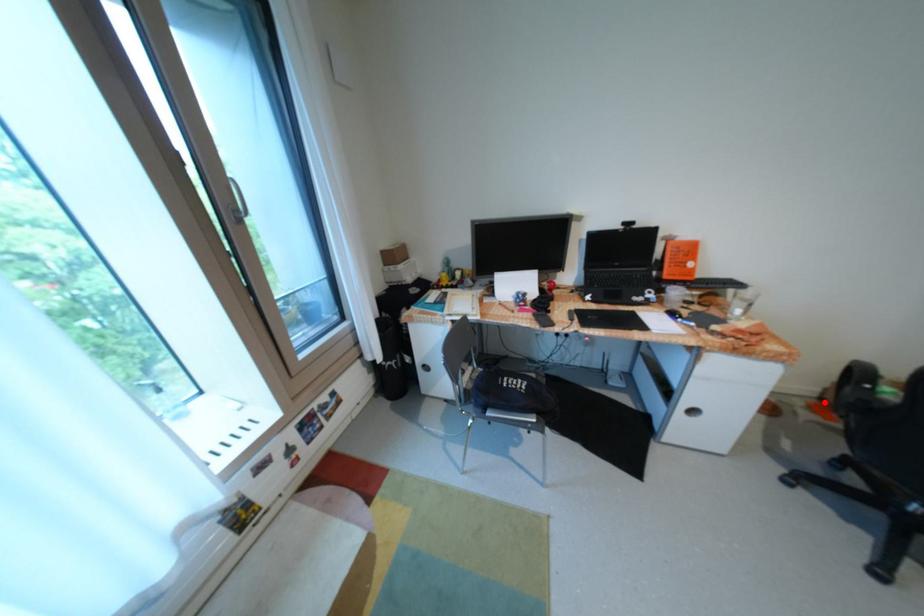
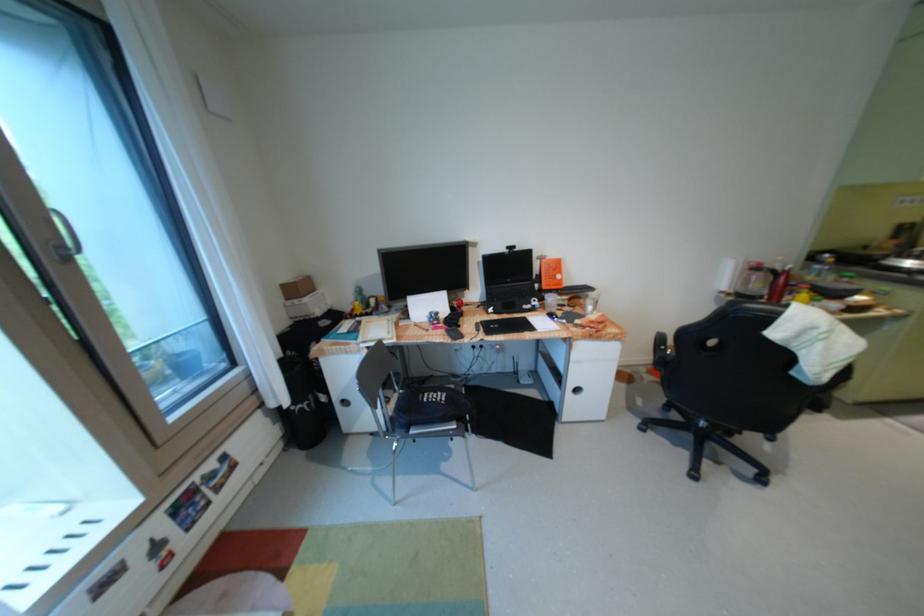
Question: I am providing you with two images of the same scene from different viewpoints. A red point is shown in image1. For the corresponding object point in image2, is it positioned nearer or farther from the camera?

Choices:
 (A) Nearer
 (B) Farther

Answer: (A)